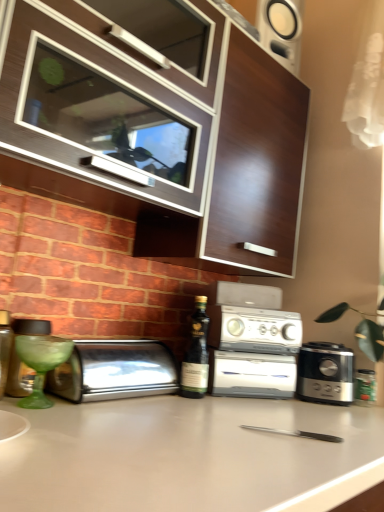
What are the coordinates of `free point in front of dark green glass bottle at center` in the screenshot? It's located at (186, 404).